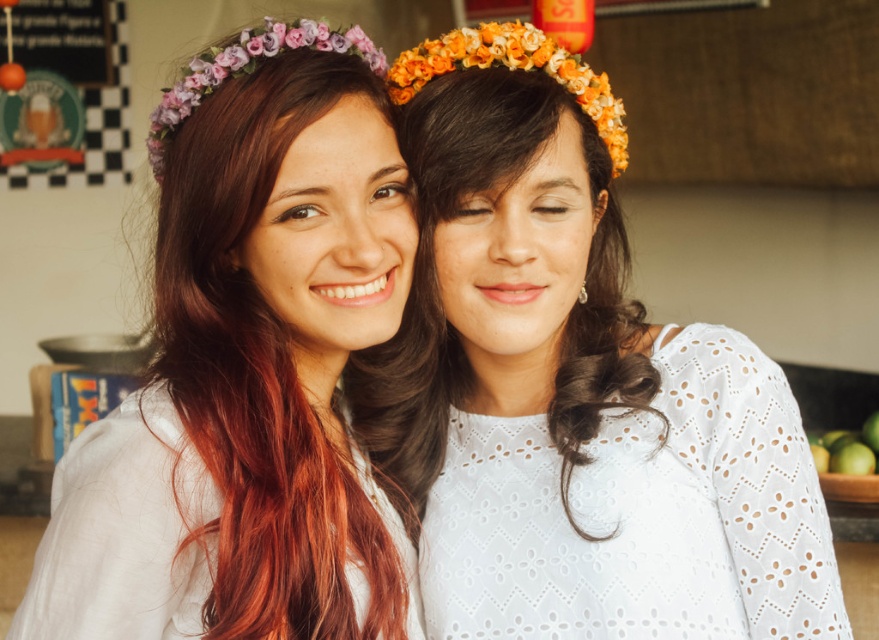
You are standing in a kitchen and see a point at coordinates (x=572, y=387). What object is located at that point?

The white lace dress at center is located at point (x=572, y=387).

You are a photographer setting up a shoot in a kitchen. You need to position a camera on a tripod so that both the white lace dress at center and the matte floral crown at upper left are in frame. Based on their positions, where should you place the camera to ensure both are visible?

The white lace dress at center is below the matte floral crown at upper left, so placing the camera at a lower angle facing upward would allow both objects to be in frame.

You are a photographer setting up a shoot in a kitchen. You need to position a camera at eye level to capture both the dark brown silky hair at center and the green matte apples at lower right clearly. Given their height difference, which object will require adjusting the camera angle more to avoid being out of frame?

The dark brown silky hair at center is much taller than the green matte apples at lower right, so adjusting the camera angle will be necessary to ensure both are in frame. However, since the dark brown silky hair at center is taller, the photographer will need to adjust the camera angle more to accommodate its height compared to the green matte apples at lower right.